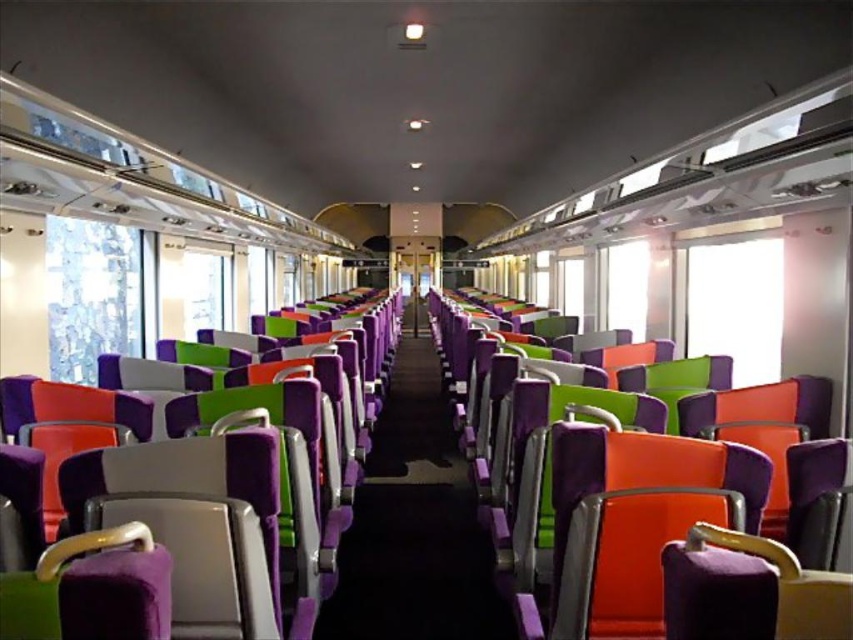
You are a photographer holding a camera. You want to take a photo of the purple fabric seat at left from a distance that allows the entire seat to fit in the frame. The camera has a maximum zoom range that can capture objects up to 1.5 meters away. Can you take the photo without moving closer?

The purple fabric seat at left and camera are 1.61 meters apart from each other. Since the camera can only capture up to 1.5 meters, you cannot take the photo without moving closer.